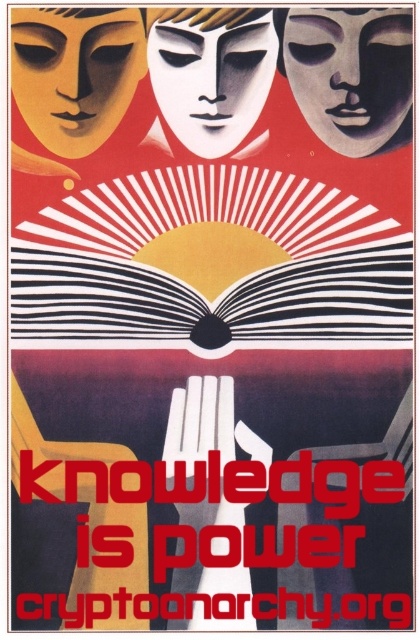
Is matte black mask at upper center further to camera compared to matte gold mask at upper left?

Yes, matte black mask at upper center is further from the viewer.

Between point (385, 29) and point (44, 145), which one is positioned in front?

Point (385, 29) is in front.

Image resolution: width=420 pixels, height=640 pixels. Find the location of `matte black mask at upper center`. matte black mask at upper center is located at coordinates (351, 74).

Does matte black mask at upper center have a lesser width compared to white matte mask at center?

Indeed, matte black mask at upper center has a lesser width compared to white matte mask at center.

Does matte black mask at upper center appear under white matte mask at center?

No, matte black mask at upper center is not below white matte mask at center.

Between point (370, 36) and point (220, 90), which one is positioned behind?

The point (220, 90) is more distant.

The height and width of the screenshot is (640, 420). In order to click on matte black mask at upper center in this screenshot , I will do `click(351, 74)`.

Is matte gold mask at upper left behind white matte mask at center?

No.

Is matte gold mask at upper left closer to camera compared to white matte mask at center?

Yes.

The image size is (420, 640). What are the coordinates of `matte gold mask at upper left` in the screenshot? It's located at tap(75, 72).

The height and width of the screenshot is (640, 420). Identify the location of matte gold mask at upper left. [75, 72].